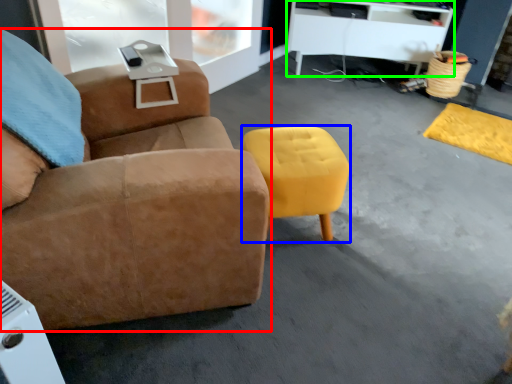
Question: Which object is positioned closest to chair (highlighted by a red box)? Select from stool (highlighted by a blue box) and desk (highlighted by a green box).

Choices:
 (A) stool
 (B) desk

Answer: (A)